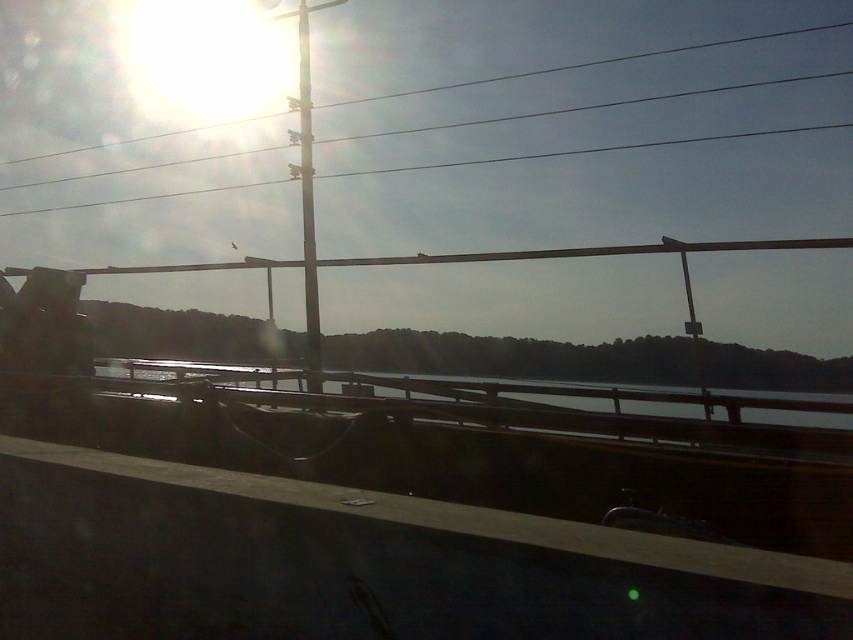
You are a drone operator trying to fly a drone between the clear water at center and the metallic wire at upper center. The drone has a maximum flight distance of 5 meters. Can the drone safely pass between them without hitting either object?

The clear water at center is 5.37 meters away from the metallic wire at upper center. Since the drone can only fly up to 5 meters, it cannot safely pass between them without exceeding its maximum distance, so it might hit one of the objects.

You are a passenger in a car and notice two metallic objects outside the window. The metallic wire at upper center and the metallic pole at center. Which one appears bigger in size?

The metallic wire at upper center is larger in size than the metallic pole at center.

You are a photographer trying to capture the metallic wire at upper center and the metallic pole at center in your shot. Which object appears thicker in the image?

The metallic wire at upper center appears thicker than the metallic pole at center because its width is larger according to the description.